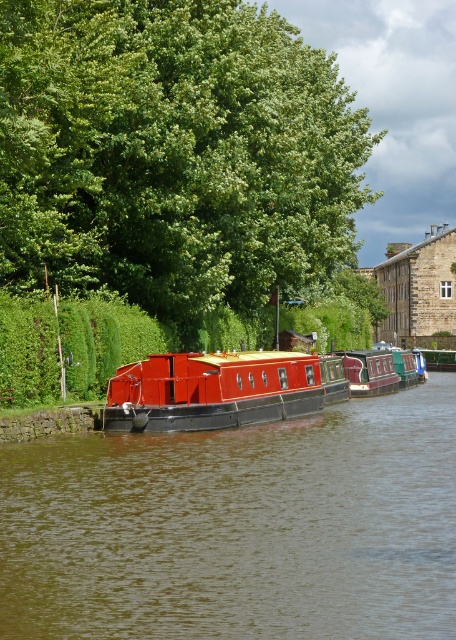
Does smooth red boat at center have a lesser width compared to metallic red barge at center?

Incorrect, smooth red boat at center's width is not less than metallic red barge at center's.

Can you confirm if smooth red boat at center is positioned to the left of metallic red barge at center?

In fact, smooth red boat at center is to the right of metallic red barge at center.

At what (x,y) coordinates should I click in order to perform the action: click on smooth red boat at center. Please return your answer as a coordinate pair (x, y). The width and height of the screenshot is (456, 640). Looking at the image, I should click on (238, 529).

Is green leafy tree at upper center positioned before smooth red boat at center?

That is False.

Is point (206, 33) farther from camera compared to point (389, 509)?

Yes, point (206, 33) is farther from viewer.

Where is `green leafy tree at upper center`? Image resolution: width=456 pixels, height=640 pixels. green leafy tree at upper center is located at coordinates (174, 154).

Does green leafy tree at upper center appear on the right side of metallic red barge at center?

Indeed, green leafy tree at upper center is positioned on the right side of metallic red barge at center.

Is point (203, 128) closer to viewer compared to point (171, 390)?

That is False.

Identify the location of green leafy tree at upper center. (174, 154).